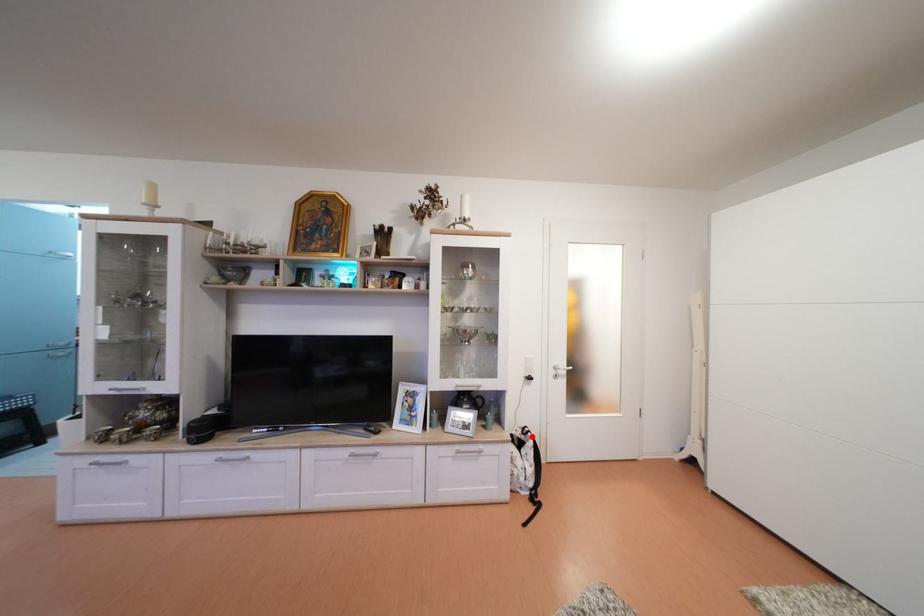
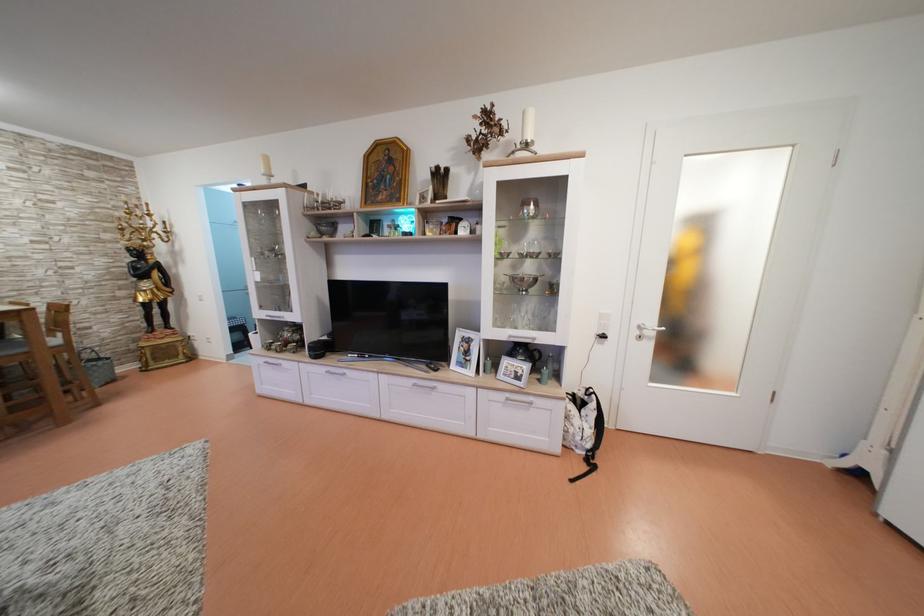
The point at the highlighted location is marked in the first image. Where is the corresponding point in the second image?

(596, 398)